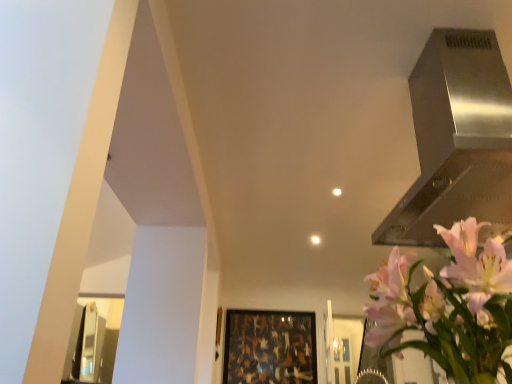
Question: Is stainless steel vent at upper right oriented towards wooden frame at center?

Choices:
 (A) no
 (B) yes

Answer: (A)

Question: Considering the relative sizes of stainless steel vent at upper right and wooden frame at center in the image provided, is stainless steel vent at upper right smaller than wooden frame at center?

Choices:
 (A) no
 (B) yes

Answer: (A)

Question: Is stainless steel vent at upper right thinner than wooden frame at center?

Choices:
 (A) no
 (B) yes

Answer: (A)

Question: Is stainless steel vent at upper right to the right of wooden frame at center from the viewer's perspective?

Choices:
 (A) no
 (B) yes

Answer: (B)

Question: From the image's perspective, is stainless steel vent at upper right located beneath wooden frame at center?

Choices:
 (A) no
 (B) yes

Answer: (A)

Question: From a real-world perspective, is stainless steel vent at upper right above or below pink matte flower at upper right?

Choices:
 (A) above
 (B) below

Answer: (A)

Question: From the image's perspective, relative to pink matte flower at upper right, is stainless steel vent at upper right above or below?

Choices:
 (A) above
 (B) below

Answer: (A)

Question: Considering the positions of stainless steel vent at upper right and pink matte flower at upper right in the image, is stainless steel vent at upper right wider or thinner than pink matte flower at upper right?

Choices:
 (A) thin
 (B) wide

Answer: (B)

Question: Considering the positions of stainless steel vent at upper right and pink matte flower at upper right in the image, is stainless steel vent at upper right taller or shorter than pink matte flower at upper right?

Choices:
 (A) short
 (B) tall

Answer: (B)

Question: Relative to stainless steel vent at upper right, is pink matte flower at upper right in front or behind?

Choices:
 (A) behind
 (B) front

Answer: (B)

Question: Does point click(x=497, y=241) appear closer or farther from the camera than point click(x=468, y=46)?

Choices:
 (A) closer
 (B) farther

Answer: (A)

Question: Looking at the image, does pink matte flower at upper right seem bigger or smaller compared to stainless steel vent at upper right?

Choices:
 (A) big
 (B) small

Answer: (B)

Question: Choose the correct answer: Is pink matte flower at upper right inside stainless steel vent at upper right or outside it?

Choices:
 (A) outside
 (B) inside

Answer: (A)

Question: Relative to stainless steel vent at upper right, is wooden frame at center in front or behind?

Choices:
 (A) behind
 (B) front

Answer: (A)

Question: From a real-world perspective, relative to stainless steel vent at upper right, is wooden frame at center vertically above or below?

Choices:
 (A) below
 (B) above

Answer: (A)